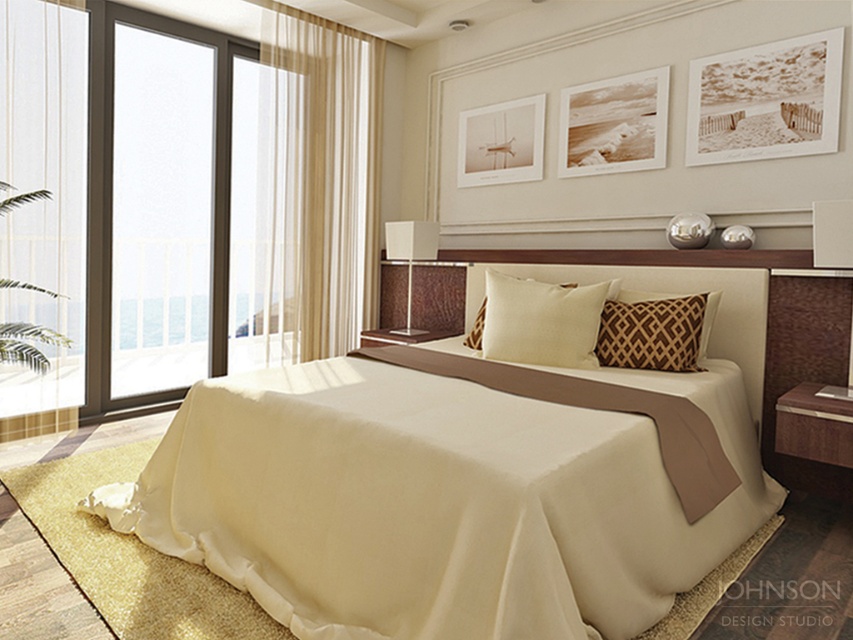
You are standing in the bedroom and want to exit through the transparent glass door at left. Which direction should you move relative to the creamy soft pillow at center?

You should move to the left of the creamy soft pillow at center to reach the transparent glass door at left since the transparent glass door at left is located to the left of the creamy soft pillow at center.